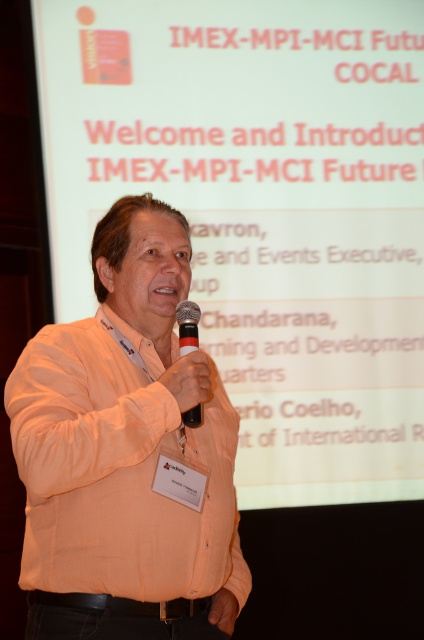
You are an event organizer setting up the stage for a presentation. You need to ensure that the orange shirt at center and black matte microphone at center are visible to the audience. Based on their positions, which object is closer to the front of the stage?

The orange shirt at center is closer to the front of the stage than the black matte microphone at center, since the microphone is positioned behind the shirt.

You are an event organizer setting up a camera to capture the speaker wearing the orange cotton shirt at center. The camera has a fixed focus at point 0.7, 0.3. Will the camera be able to capture the speaker clearly?

The orange cotton shirt at center is positioned at point (127, 454), which is very close to the camera focus at (127, 448). The slight difference in coordinates means the camera should still capture the speaker clearly.